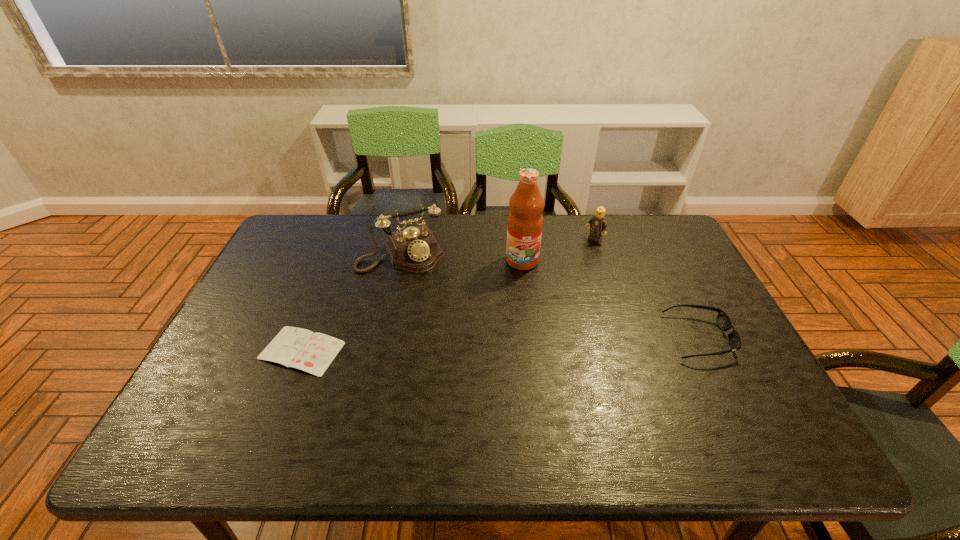
You are a GUI agent. You are given a task and a screenshot of the screen. Output one action in this format:
    pyautogui.click(x=<x>, y=<y>)
    Task: Click on the vacant space on the desktop that is between the shortest object and the second shortest object and is positioned on the front label of the fruit juice
    
    Given the screenshot: What is the action you would take?
    pyautogui.click(x=523, y=343)

Where is `vacant space on the desktop that is between the diary and the sunglasses and is positioned on the dial of the second tallest object`? vacant space on the desktop that is between the diary and the sunglasses and is positioned on the dial of the second tallest object is located at coordinates (444, 346).

The image size is (960, 540). What are the coordinates of `free space on the desktop that is between the shortest object and the sunglasses and is positioned in front of the Lego` in the screenshot? It's located at (466, 345).